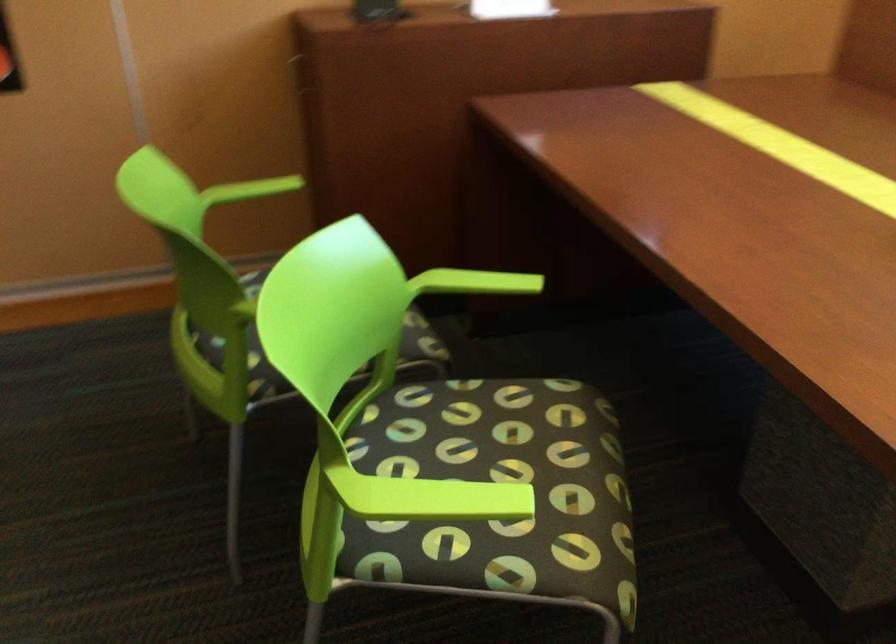
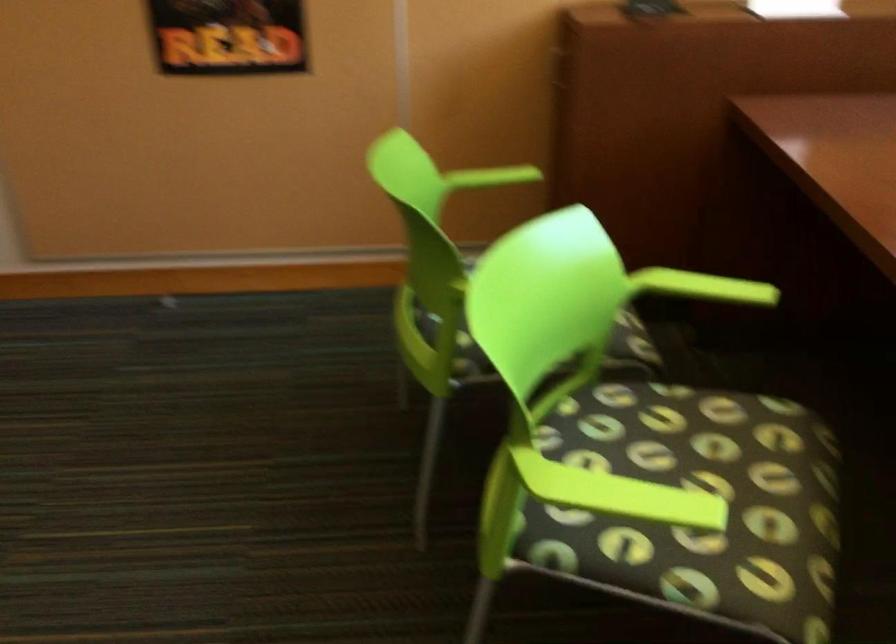
Question: The camera is either moving clockwise (left) or counter-clockwise (right) around the object. The first image is from the beginning of the video and the second image is from the end. Is the camera moving left or right when shooting the video?

Choices:
 (A) Left
 (B) Right

Answer: (B)